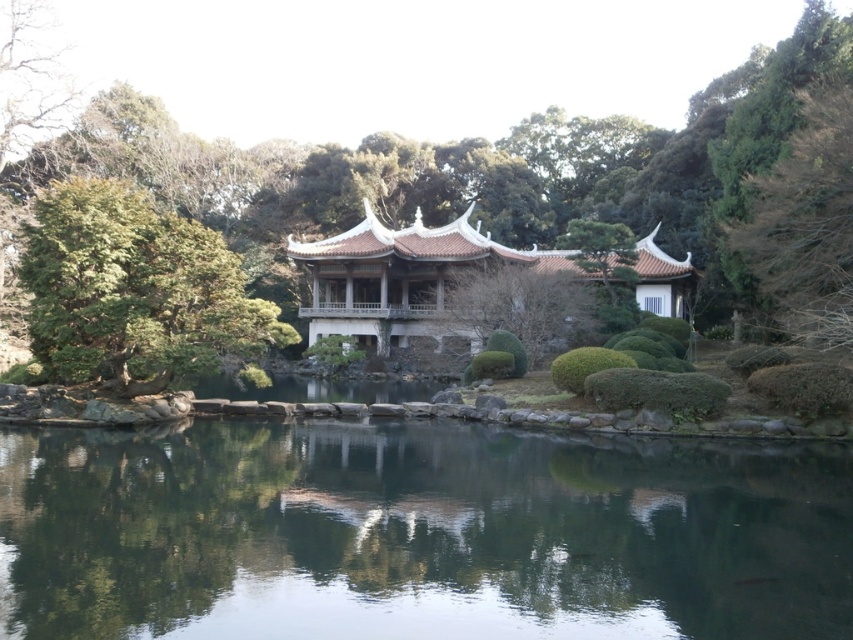
Consider the image. You are standing in the Japanese garden and want to place a small decorative stone between the two points, point (618, 596) and point (439, 292). Which point should you start from to ensure the stone is closer to the pavilion?

Point (439, 292) is farther from the viewer than point (618, 596). Since the pavilion is at the center, placing the stone closer to the farther point would make it nearer to the pavilion. Therefore, start from point (439, 292) to position the stone closer to the pavilion.

You are a visitor in the Japanese garden and want to take a photo of the wooden gazebo at center without any obstructions. However, there is a green leafy tree at left in your view. Can you adjust your position to avoid the tree?

The green leafy tree at left is positioned over the wooden gazebo at center, so moving to the right side might allow you to capture the wooden gazebo at center without the tree obstructing the view.

You are planning to take a photo of the wooden gazebo at center and the green leafy tree at left. Which object should you focus on first if you want to capture both in the same frame without moving the camera?

The green leafy tree at left is larger in size than the wooden gazebo at center, so you should focus on the green leafy tree at left first to ensure it fits properly in the frame.